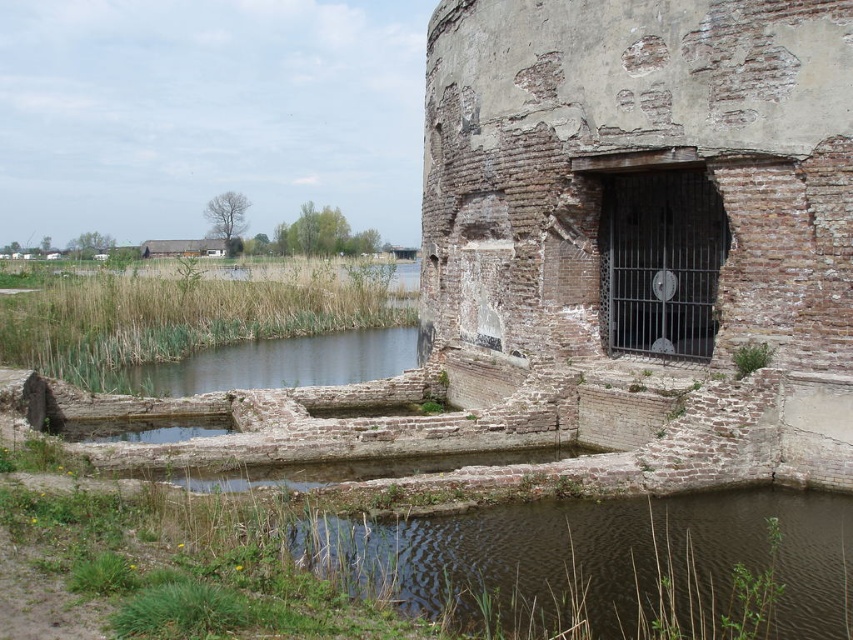
Consider the image. Can you confirm if weathered brick wall at center right is positioned to the left of brown/rough stone pond at lower center?

Yes, weathered brick wall at center right is to the left of brown/rough stone pond at lower center.

Does point (450, 92) lie in front of point (444, 518)?

No.

Where is `weathered brick wall at center right`? This screenshot has width=853, height=640. weathered brick wall at center right is located at coordinates (650, 196).

Image resolution: width=853 pixels, height=640 pixels. Identify the location of weathered brick wall at center right. (650, 196).